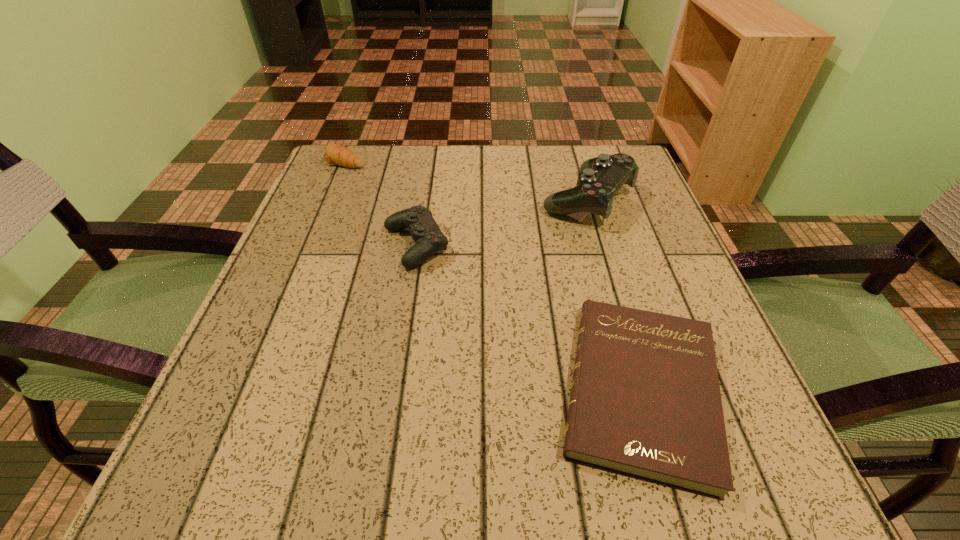
Find the location of `free spot located 0.050m on the front of the farthest object`. free spot located 0.050m on the front of the farthest object is located at coordinates (336, 182).

You are a GUI agent. You are given a task and a screenshot of the screen. Output one action in this format:
    pyautogui.click(x=<x>, y=<y>)
    Task: Click on the free region located 0.270m on the back of the nearest object
    
    Given the screenshot: What is the action you would take?
    pyautogui.click(x=589, y=213)

Where is `control at the far edge`? The height and width of the screenshot is (540, 960). control at the far edge is located at coordinates (601, 177).

Find the location of a particular element. This screenshot has height=540, width=960. crescent roll that is positioned at the far edge is located at coordinates (336, 154).

Where is `object that is at the near edge`? Image resolution: width=960 pixels, height=540 pixels. object that is at the near edge is located at coordinates (645, 402).

You are a GUI agent. You are given a task and a screenshot of the screen. Output one action in this format:
    pyautogui.click(x=<x>, y=<y>)
    Task: Click on the object that is positioned at the left edge
    
    Given the screenshot: What is the action you would take?
    pyautogui.click(x=336, y=154)

The height and width of the screenshot is (540, 960). Find the location of `control positioned at the right edge`. control positioned at the right edge is located at coordinates (601, 177).

Identify the location of hardback book that is at the right edge. (645, 402).

Locate an element on the screen. The image size is (960, 540). object located in the far left corner section of the desktop is located at coordinates (336, 154).

This screenshot has height=540, width=960. What are the coordinates of `object located at the far right corner` in the screenshot? It's located at (601, 177).